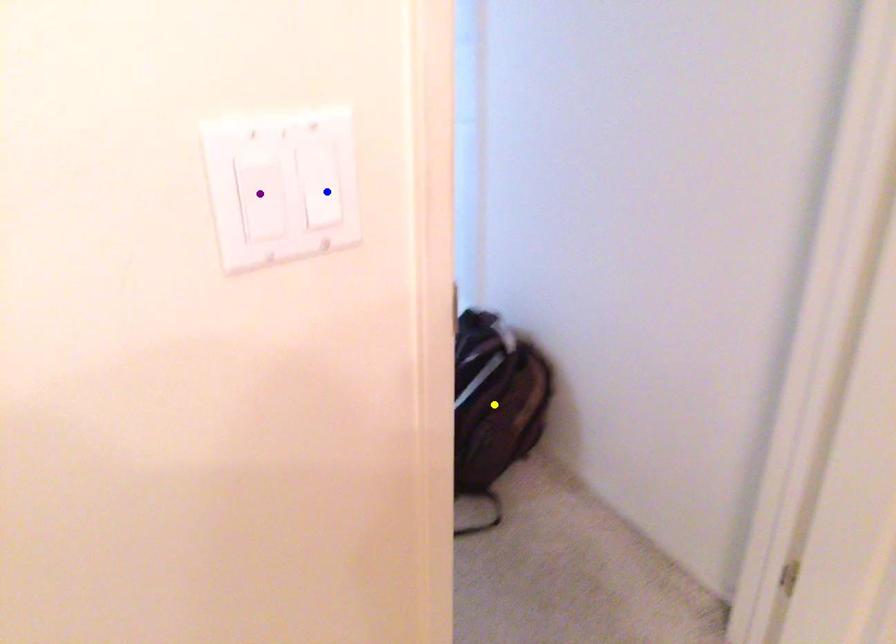
Order these from nearest to farthest:
purple point | blue point | yellow point

purple point, blue point, yellow point